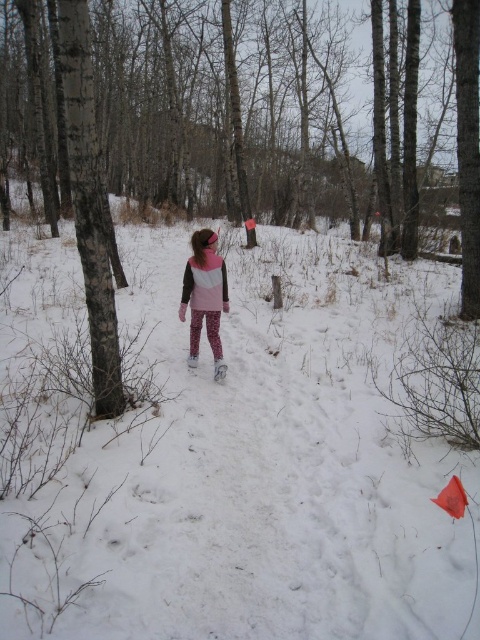
In the snowy forest scene, there is a brown bark tree at center and a pink matte jacket at center. Which object is taller?

The brown bark tree at center is taller than the pink matte jacket at center.

You are standing in the snowy forest and see the brown bark tree at center and the pink matte jacket at center. Which object is nearer to you?

The brown bark tree at center is closer to the viewer than the pink matte jacket at center.